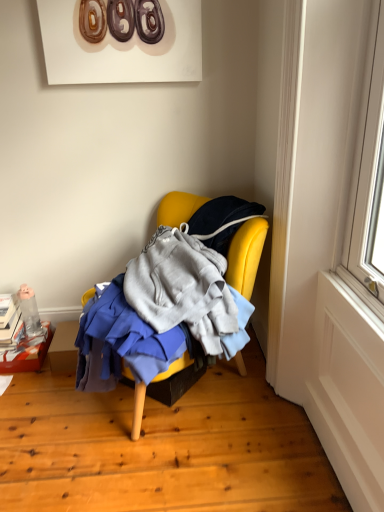
What do you see at coordinates (29, 311) in the screenshot? This screenshot has width=384, height=512. I see `translucent plastic bottle at lower left` at bounding box center [29, 311].

Where is `cardboard box at lower left`? cardboard box at lower left is located at coordinates (26, 354).

I want to click on translucent plastic bottle at lower left, so click(x=29, y=311).

Considering the positions of objects cardboard box at lower left and translucent plastic bottle at lower left in the image provided, who is more to the left, cardboard box at lower left or translucent plastic bottle at lower left?

cardboard box at lower left is more to the left.

From a real-world perspective, is cardboard box at lower left positioned above or below translucent plastic bottle at lower left?

Clearly, from a real-world perspective, cardboard box at lower left is below translucent plastic bottle at lower left.

In terms of width, does cardboard box at lower left look wider or thinner when compared to translucent plastic bottle at lower left?

Clearly, cardboard box at lower left has more width compared to translucent plastic bottle at lower left.

From the picture: From a real-world perspective, between yellow fabric chair at center and translucent plastic bottle at lower left, who is vertically lower?

From a 3D spatial view, translucent plastic bottle at lower left is below.

Would you say yellow fabric chair at center is outside translucent plastic bottle at lower left?

Yes.

Which object is wider, yellow fabric chair at center or translucent plastic bottle at lower left?

yellow fabric chair at center is wider.

How many degrees apart are the facing directions of yellow fabric chair at center and translucent plastic bottle at lower left?

There is a 58.7-degree angle between the facing directions of yellow fabric chair at center and translucent plastic bottle at lower left.

Is cardboard box at lower left a part of translucent plastic bottle at lower left?

No, translucent plastic bottle at lower left does not contain cardboard box at lower left.

Which point is more distant from viewer, (38, 325) or (24, 361)?

Point (38, 325)

Would you say translucent plastic bottle at lower left is to the left or to the right of cardboard box at lower left in the picture?

translucent plastic bottle at lower left is to the right of cardboard box at lower left.

From a real-world perspective, is translucent plastic bottle at lower left positioned under cardboard box at lower left based on gravity?

No, from a real-world perspective, translucent plastic bottle at lower left is not beneath cardboard box at lower left.

Does point (244, 273) lie behind point (49, 324)?

No, (244, 273) is in front of (49, 324).

From the image's perspective, is yellow fabric chair at center below cardboard box at lower left?

Actually, yellow fabric chair at center appears above cardboard box at lower left in the image.

Who is bigger, yellow fabric chair at center or cardboard box at lower left?

yellow fabric chair at center.

Does yellow fabric chair at center turn towards cardboard box at lower left?

No, yellow fabric chair at center is not facing towards cardboard box at lower left.

Is translucent plastic bottle at lower left facing away from yellow fabric chair at center?

That's not correct — translucent plastic bottle at lower left is not looking away from yellow fabric chair at center.

Does translucent plastic bottle at lower left lie in front of yellow fabric chair at center?

No, translucent plastic bottle at lower left is further to the viewer.

From the image's perspective, between translucent plastic bottle at lower left and yellow fabric chair at center, who is located below?

From the image's view, translucent plastic bottle at lower left is below.

Considering the sizes of objects cardboard box at lower left and yellow fabric chair at center in the image provided, who is shorter, cardboard box at lower left or yellow fabric chair at center?

cardboard box at lower left is shorter.

How far apart are cardboard box at lower left and yellow fabric chair at center?

cardboard box at lower left and yellow fabric chair at center are 3.33 feet apart from each other.

Is cardboard box at lower left facing away from yellow fabric chair at center?

No, cardboard box at lower left is not facing the opposite direction of yellow fabric chair at center.

Does cardboard box at lower left contain yellow fabric chair at center?

No, cardboard box at lower left does not contain yellow fabric chair at center.

I want to click on bottle that is above the cardboard box at lower left (from a real-world perspective), so click(x=29, y=311).

At what (x,y) coordinates should I click in order to perform the action: click on bottle on the left of yellow fabric chair at center. Please return your answer as a coordinate pair (x, y). Looking at the image, I should click on (29, 311).

When comparing their distances from translucent plastic bottle at lower left, does yellow fabric chair at center or cardboard box at lower left seem closer?

cardboard box at lower left is positioned closer to the anchor translucent plastic bottle at lower left.

Looking at the image, which one is located further to yellow fabric chair at center, translucent plastic bottle at lower left or cardboard box at lower left?

cardboard box at lower left lies further to yellow fabric chair at center than the other object.

Which object lies further to the anchor point yellow fabric chair at center, cardboard box at lower left or translucent plastic bottle at lower left?

Among the two, cardboard box at lower left is located further to yellow fabric chair at center.

Which object lies nearer to the anchor point cardboard box at lower left, translucent plastic bottle at lower left or yellow fabric chair at center?

translucent plastic bottle at lower left lies closer to cardboard box at lower left than the other object.

Based on their spatial positions, is yellow fabric chair at center or translucent plastic bottle at lower left closer to cardboard box at lower left?

translucent plastic bottle at lower left.

Estimate the real-world distances between objects in this image. Which object is closer to translucent plastic bottle at lower left, cardboard box at lower left or yellow fabric chair at center?

The object closer to translucent plastic bottle at lower left is cardboard box at lower left.

Find the location of a particular element. This screenshot has width=384, height=512. box between yellow fabric chair at center and translucent plastic bottle at lower left along the z-axis is located at coordinates (26, 354).